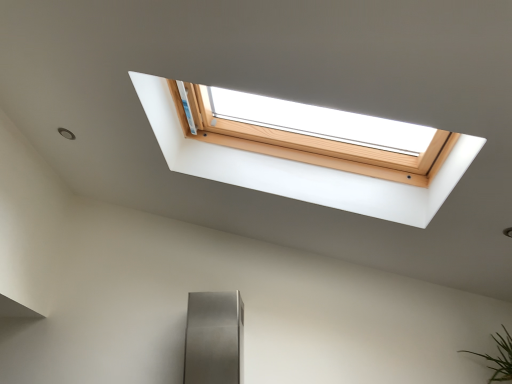
In order to click on green leafy plant at lower right in this screenshot , I will do `click(499, 357)`.

What do you see at coordinates (499, 357) in the screenshot?
I see `green leafy plant at lower right` at bounding box center [499, 357].

Find the location of a particular element. green leafy plant at lower right is located at coordinates (499, 357).